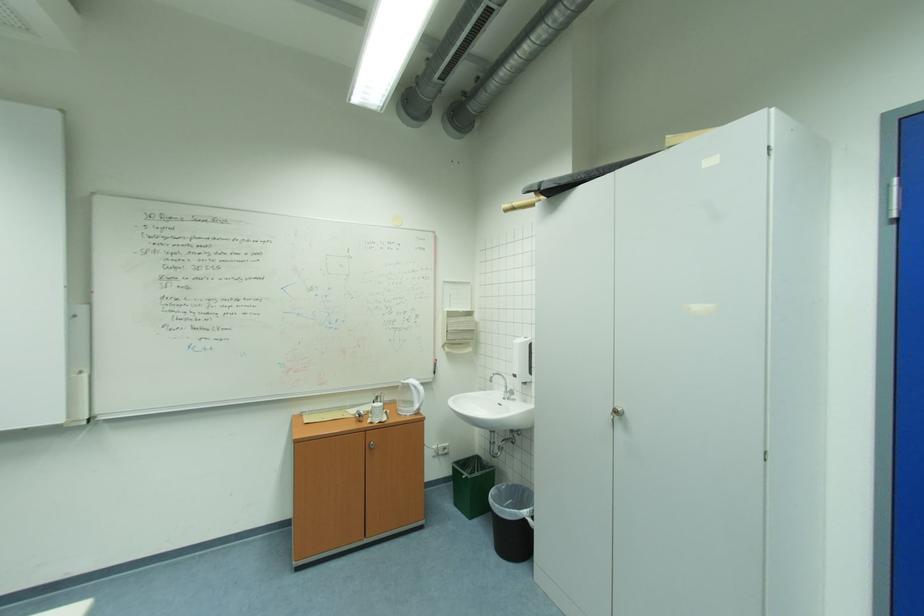
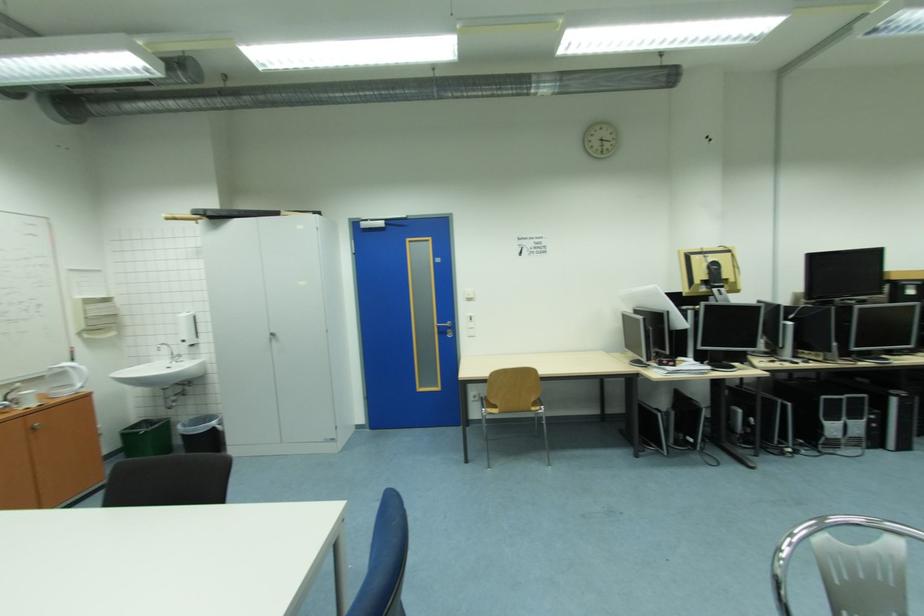
Find the pixel in the second image that matches [523,377] in the first image.

(189, 342)